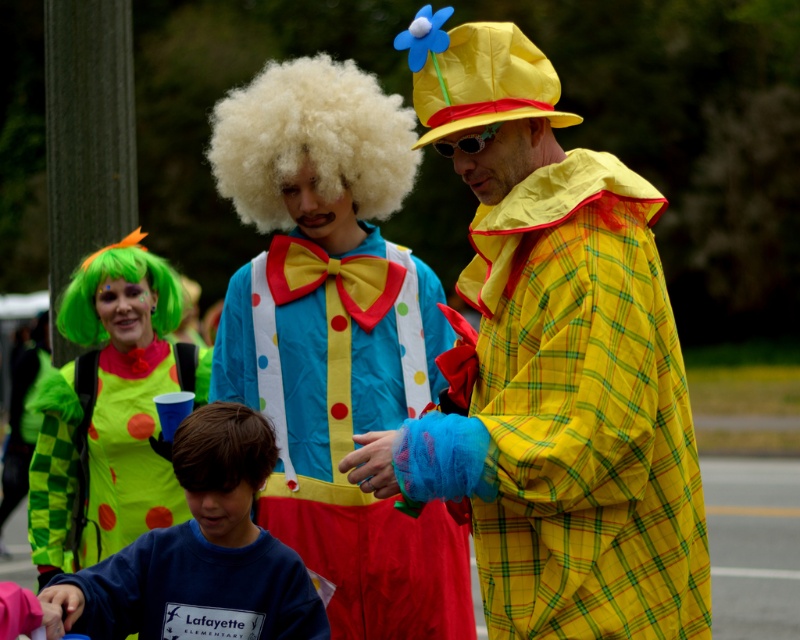
Does polka dot fabric clown suit at center have a lesser width compared to blue cotton sweatshirt at lower left?

No.

This screenshot has height=640, width=800. What do you see at coordinates (348, 426) in the screenshot?
I see `polka dot fabric clown suit at center` at bounding box center [348, 426].

Does point (258, 355) come in front of point (224, 476)?

No, it is not.

The width and height of the screenshot is (800, 640). What are the coordinates of `polka dot fabric clown suit at center` in the screenshot? It's located at (348, 426).

Can you confirm if fluffy white wig at center is bigger than green matte wig at left?

Yes.

Is fluffy white wig at center thinner than green matte wig at left?

No, fluffy white wig at center is not thinner than green matte wig at left.

This screenshot has height=640, width=800. I want to click on fluffy white wig at center, so click(312, 140).

Between polka dot fabric clown suit at center and fluffy white wig at center, which one appears on the right side from the viewer's perspective?

polka dot fabric clown suit at center

Where is `polka dot fabric clown suit at center`? This screenshot has width=800, height=640. polka dot fabric clown suit at center is located at coordinates (348, 426).